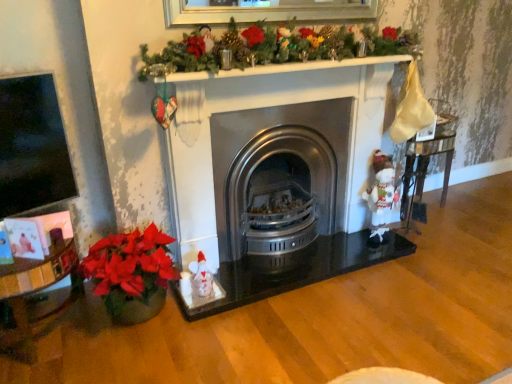
The width and height of the screenshot is (512, 384). Find the location of `space that is in front of wooden glossy table at right`. space that is in front of wooden glossy table at right is located at coordinates (442, 231).